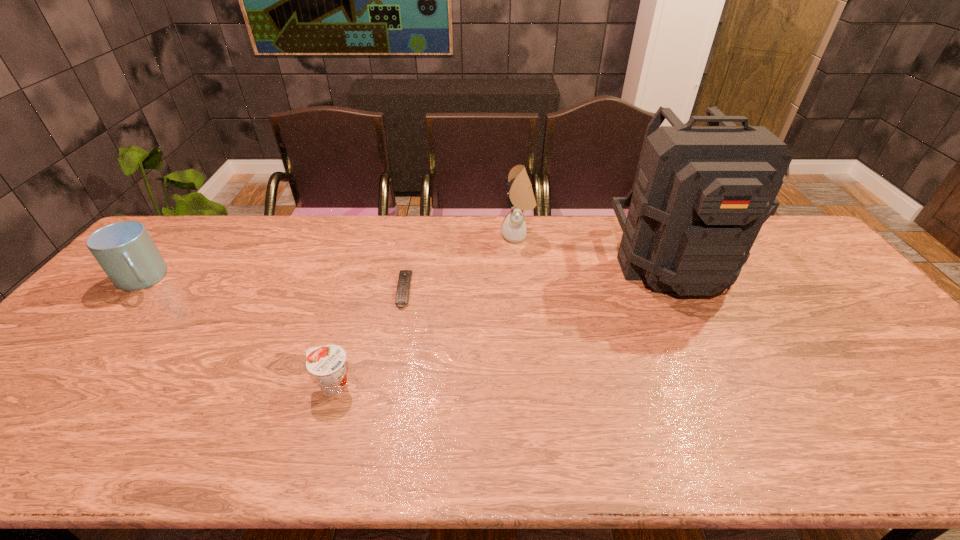
You are a GUI agent. You are given a task and a screenshot of the screen. Output one action in this format:
    pyautogui.click(x=<x>, y=<y>)
    Task: Click on the vacant space located 0.280m on the front compartment of the tallest object
    This screenshot has width=960, height=540.
    Given the screenshot: What is the action you would take?
    pyautogui.click(x=736, y=390)

The height and width of the screenshot is (540, 960). In order to click on vacant space located 0.240m at the front face of the second object from right to left in this screenshot , I will do `click(430, 236)`.

What are the coordinates of `free space located 0.090m at the front face of the second object from right to left` in the screenshot? It's located at (474, 236).

Find the location of a particular element. vacant space located 0.370m at the front face of the second object from right to left is located at coordinates (392, 236).

Find the location of a particular element. free region located on the right of the mug is located at coordinates (x=288, y=280).

Image resolution: width=960 pixels, height=540 pixels. I want to click on free space located 0.370m on the back of the nearest object, so click(367, 272).

Where is `vacant area situated on the front of the shortest object`? This screenshot has width=960, height=540. vacant area situated on the front of the shortest object is located at coordinates (376, 435).

Find the location of a particular element. backpack situated at the far edge is located at coordinates (701, 194).

The image size is (960, 540). Find the location of `doll located in the far edge section of the desktop`. doll located in the far edge section of the desktop is located at coordinates (520, 197).

Where is `object that is at the left edge`? The width and height of the screenshot is (960, 540). object that is at the left edge is located at coordinates coord(126,252).